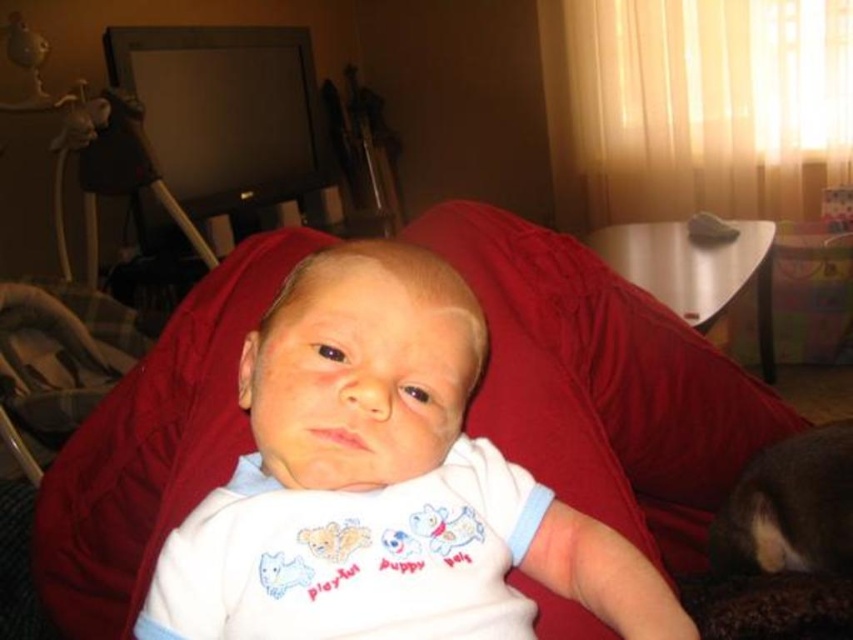
You are a parent trying to place a new toy on the floor between the white soft fabric baby at center and the metallic gray armchair at left. Can you fit the toy there without moving either object?

The white soft fabric baby at center occupies less space than the metallic gray armchair at left, so there is enough space between them to place the toy without moving either object.

You are a photographer setting up for a baby photoshoot. You need to position a softbox light between the white soft fabric baby at center and the metallic gray armchair at left. Which object should the light be placed closer to to ensure the baby is well lit?

The softbox light should be placed closer to the white soft fabric baby at center since it is closer to the viewer than the metallic gray armchair at left, ensuring proper lighting on the baby.

What are the coordinates of the white soft fabric baby at center?

The white soft fabric baby at center is located at point (x=381, y=483).